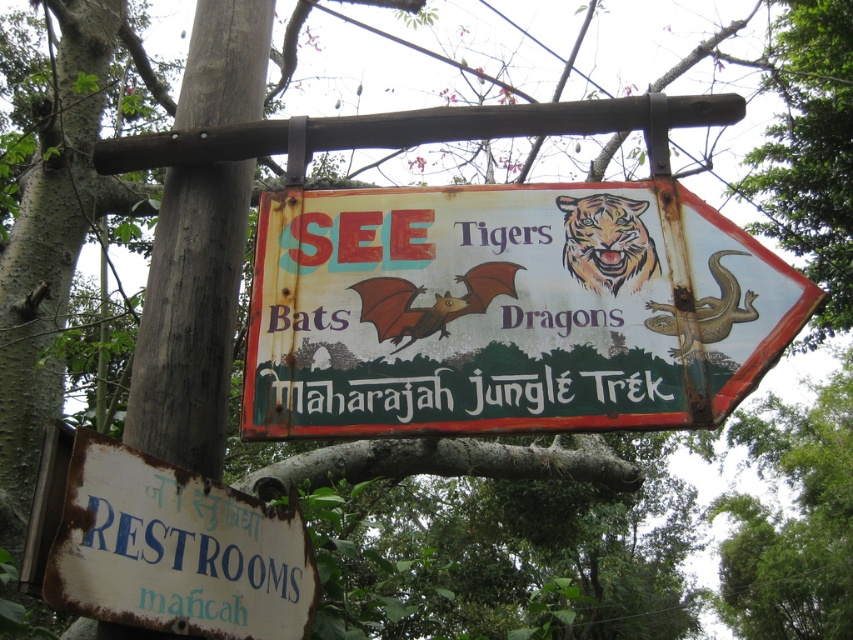
Does rusty metal sign at center appear on the left side of white painted text at center?

Incorrect, rusty metal sign at center is not on the left side of white painted text at center.

The width and height of the screenshot is (853, 640). Find the location of `rusty metal sign at center`. rusty metal sign at center is located at coordinates (508, 310).

Measure the distance from rusty white signboard at lower left to white painted text at center.

A distance of 16.73 inches exists between rusty white signboard at lower left and white painted text at center.

Who is shorter, rusty white signboard at lower left or white painted text at center?

white painted text at center is shorter.

Locate an element on the screen. This screenshot has width=853, height=640. rusty white signboard at lower left is located at coordinates (173, 548).

At what (x,y) coordinates should I click in order to perform the action: click on rusty white signboard at lower left. Please return your answer as a coordinate pair (x, y). Looking at the image, I should click on (173, 548).

Is point (277, 259) positioned in front of point (289, 557)?

No, (277, 259) is behind (289, 557).

Does point (316, 212) come in front of point (287, 612)?

No.

Where is `rusty metal sign at center`? The height and width of the screenshot is (640, 853). rusty metal sign at center is located at coordinates (508, 310).